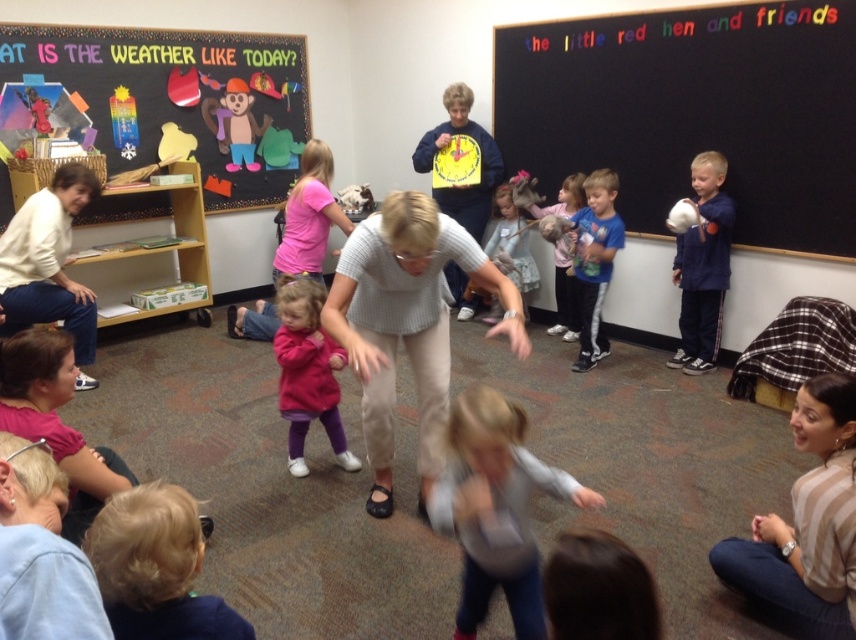
You are a student in the classroom and you want to hang both the light gray knit sweater at center and the blue cotton shirt at right on the same hook. Which one will have more space below it after hanging?

The light gray knit sweater at center has a lesser height compared to blue cotton shirt at right, so after hanging, the light gray knit sweater at center will have more space below it.

You are a teacher preparing to hang a new poster that is 1 meter wide. You have two options for placement on the wall where the black chalkboard at upper right and the multicolored paper weather symbols at upper left are located. Based on their sizes, which object can accommodate the poster without needing to be moved?

The black chalkboard at upper right is bigger than the multicolored paper weather symbols at upper left, so the poster can be placed near the black chalkboard at upper right without needing to move it.

You are a student in the classroom and need to point out the black chalkboard at upper right and the multicolored paper weather symbols at upper left. Which one is located to the right of the other?

The black chalkboard at upper right is positioned on the right side of multicolored paper weather symbols at upper left.